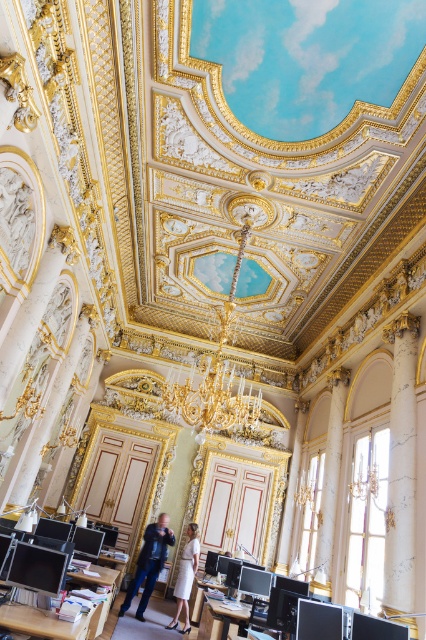
Is point (385, 556) positioned behind point (322, 579)?

No, (385, 556) is in front of (322, 579).

Is white marble column at right to the right of white marble pillar at center from the viewer's perspective?

Yes, white marble column at right is to the right of white marble pillar at center.

The height and width of the screenshot is (640, 426). What do you see at coordinates (400, 470) in the screenshot? I see `white marble column at right` at bounding box center [400, 470].

This screenshot has height=640, width=426. I want to click on white marble column at right, so (400, 470).

Is gold metallic chandelier at center shorter than matte black jacket at center?

Indeed, gold metallic chandelier at center has a lesser height compared to matte black jacket at center.

Looking at this image, who is more forward, (204, 412) or (161, 545)?

Point (204, 412) is more forward.

Is point (229, 404) positioned in front of point (158, 563)?

Yes, it is.

The image size is (426, 640). I want to click on gold metallic chandelier at center, so click(x=213, y=390).

Which is in front, point (339, 476) or point (186, 618)?

Point (186, 618) is in front.

Is white marble pillar at center shorter than white satin dress at center?

In fact, white marble pillar at center may be taller than white satin dress at center.

You are a GUI agent. You are given a task and a screenshot of the screen. Output one action in this format:
    pyautogui.click(x=<x>, y=<y>)
    Task: Click on the white marble pillar at center
    
    Given the screenshot: What is the action you would take?
    pyautogui.click(x=330, y=480)

You are a GUI agent. You are given a task and a screenshot of the screen. Output one action in this format:
    pyautogui.click(x=<x>, y=<y>)
    Task: Click on the white marble pillar at center
    The image size is (426, 640).
    Given the screenshot: What is the action you would take?
    pyautogui.click(x=330, y=480)